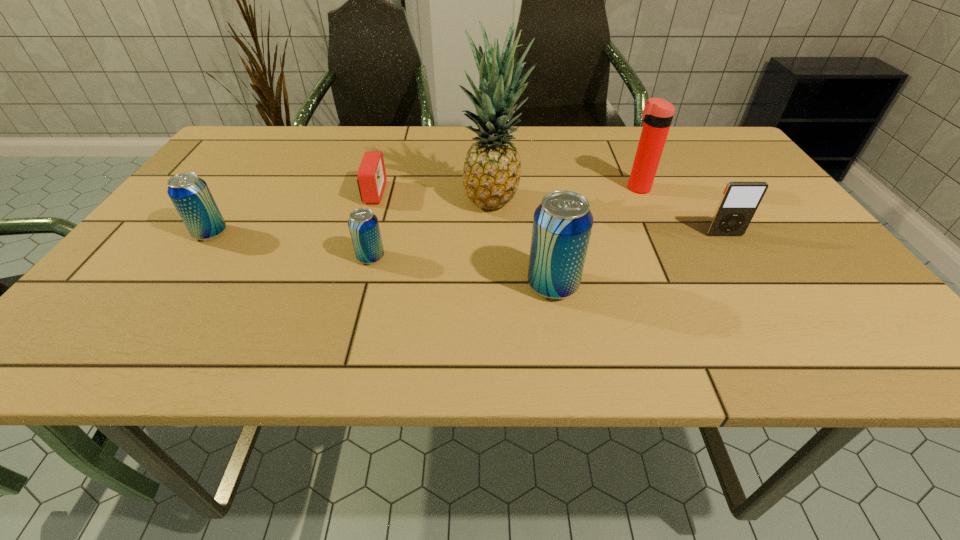
Where is `the farthest beer can`? The height and width of the screenshot is (540, 960). the farthest beer can is located at coordinates (190, 194).

You are a GUI agent. You are given a task and a screenshot of the screen. Output one action in this format:
    pyautogui.click(x=<x>, y=<y>)
    Task: Click on the leftmost object
    
    Given the screenshot: What is the action you would take?
    pyautogui.click(x=190, y=194)

Where is `the second nearest object`? This screenshot has width=960, height=540. the second nearest object is located at coordinates (363, 224).

At what (x,y) coordinates should I click in order to perform the action: click on the second beer can from right to left. Please return your answer as a coordinate pair (x, y). Looking at the image, I should click on (363, 224).

At what (x,y) coordinates should I click in order to perform the action: click on the nearest beer can. Please return your answer as a coordinate pair (x, y). Image resolution: width=960 pixels, height=540 pixels. Looking at the image, I should click on pos(562,224).

Find the location of a particular element. the rightmost beer can is located at coordinates (562, 224).

This screenshot has width=960, height=540. I want to click on thermos bottle, so click(658, 113).

Find the location of a particular element. This screenshot has height=540, width=960. pineapple is located at coordinates (492, 168).

Identify the location of alarm clock. Image resolution: width=960 pixels, height=540 pixels. (371, 177).

I want to click on iPod, so click(x=740, y=200).